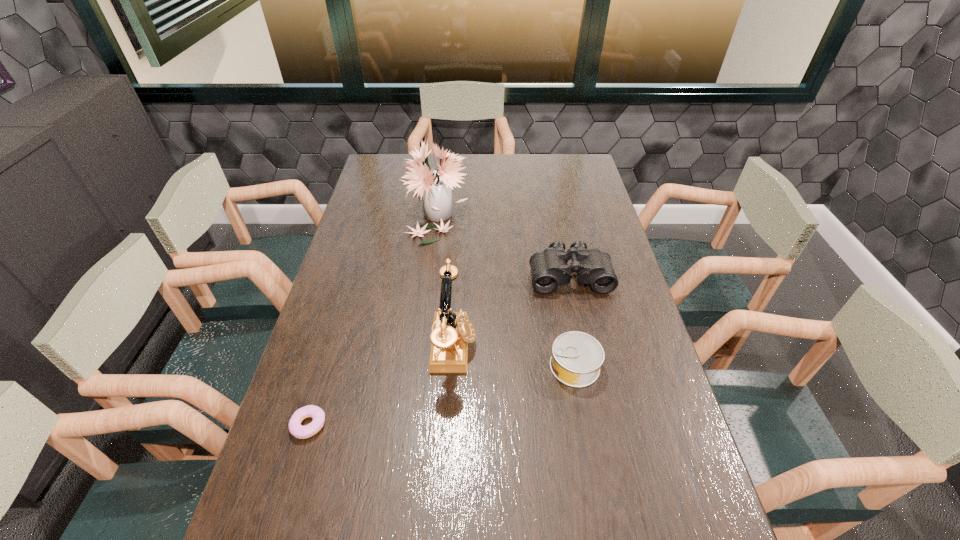
I want to click on vacant area located 0.140m at the eyepieces of the fourth nearest object, so click(581, 330).

You are a GUI agent. You are given a task and a screenshot of the screen. Output one action in this format:
    pyautogui.click(x=<x>, y=<y>)
    Task: Click on the vacant region located 0.310m on the front of the can
    This screenshot has width=960, height=540.
    Given the screenshot: What is the action you would take?
    pyautogui.click(x=603, y=523)

Where is `vacant space located on the front of the doughnut`? Image resolution: width=960 pixels, height=540 pixels. vacant space located on the front of the doughnut is located at coordinates (292, 482).

This screenshot has height=540, width=960. Identify the location of object situated at the far edge. (435, 187).

Locate an element on the screen. The image size is (960, 540). object situated at the left edge is located at coordinates (296, 429).

In order to click on binoculars present at the right edge in this screenshot , I will do `click(549, 268)`.

Find the location of `can at the right edge`. can at the right edge is located at coordinates (577, 357).

At what (x,y) coordinates should I click in order to perform the action: click on free space at the far edge of the desktop. Please return your answer as a coordinate pair (x, y). The height and width of the screenshot is (540, 960). Looking at the image, I should click on (429, 157).

The image size is (960, 540). Find the location of `free space at the left edge of the desktop`. free space at the left edge of the desktop is located at coordinates (348, 351).

This screenshot has height=540, width=960. In order to click on vacant space at the right edge of the desktop in this screenshot , I will do `click(672, 523)`.